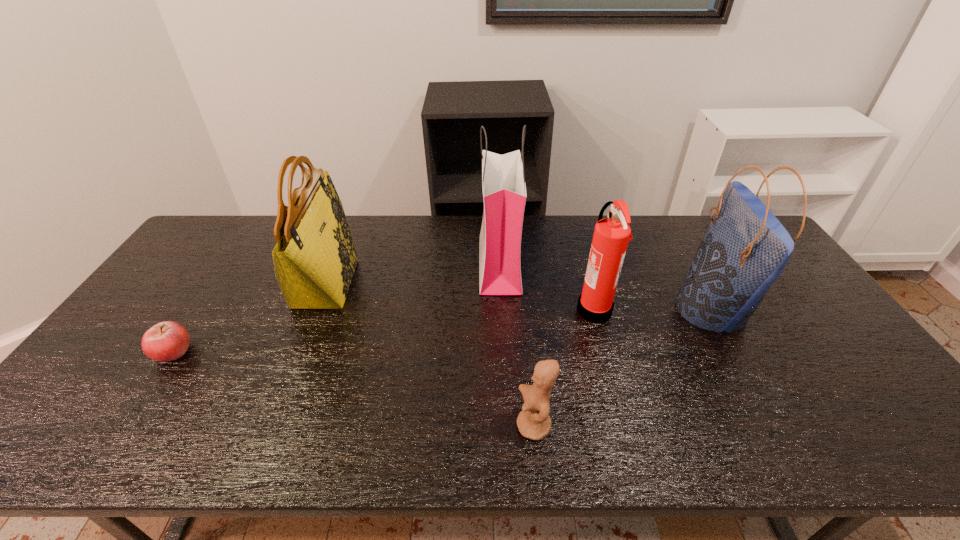
This screenshot has width=960, height=540. Identify the location of vacant space that is in between the second object from right to left and the rightmost object. (653, 309).

Locate an element on the screen. The image size is (960, 540). free space between the left shopping bag and the figurine is located at coordinates (516, 345).

The height and width of the screenshot is (540, 960). I want to click on empty space between the second object from left to right and the apple, so click(x=250, y=317).

Where is `free space between the rightmost object and the second object from left to right`? free space between the rightmost object and the second object from left to right is located at coordinates (519, 296).

Where is `blank region between the left shopping bag and the fifth tallest object`? This screenshot has width=960, height=540. blank region between the left shopping bag and the fifth tallest object is located at coordinates (516, 345).

The width and height of the screenshot is (960, 540). In order to click on free space between the fifth object from right to left and the figurine in this screenshot , I will do `click(430, 355)`.

At what (x,y) coordinates should I click in order to perform the action: click on free space between the right shopping bag and the second object from left to right. Please return your answer as a coordinate pair (x, y). This screenshot has width=960, height=540. Looking at the image, I should click on (519, 296).

Point out which object is positioned as the nearest to the left shopping bag. Please provide its 2D coordinates. Your answer should be formatted as a tuple, i.e. [(x, y)], where the tuple contains the x and y coordinates of a point satisfying the conditions above.

[(611, 236)]

The image size is (960, 540). I want to click on object that stands as the fourth closest to the leftmost object, so click(x=611, y=236).

The image size is (960, 540). I want to click on vacant space that satisfies the following two spatial constraints: 1. with the nozzle aimed from the fire extinguisher; 2. on the right side of the right shopping bag, so click(593, 310).